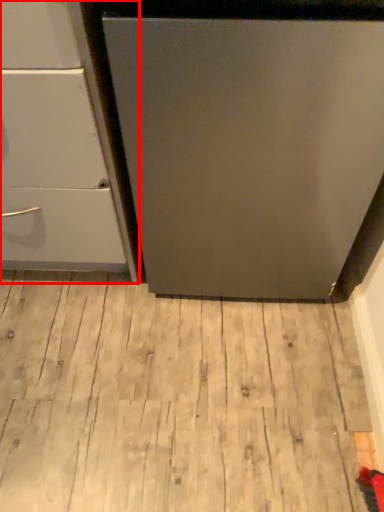
Question: From the image, what is the correct spatial relationship of chest of drawers (annotated by the red box) in relation to hardwood?

Choices:
 (A) left
 (B) right

Answer: (A)